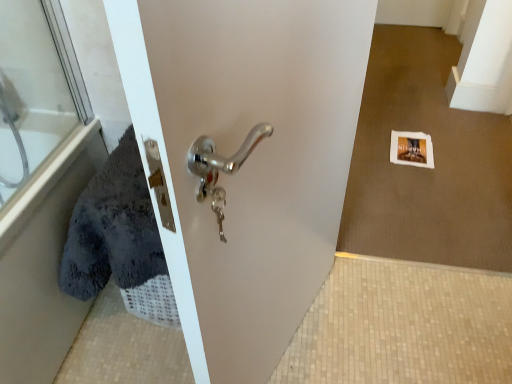
Question: From a real-world perspective, is transparent glass door at upper left on top of soft gray towel at left?

Choices:
 (A) no
 (B) yes

Answer: (B)

Question: Is soft gray towel at left at the back of transparent glass door at upper left?

Choices:
 (A) no
 (B) yes

Answer: (B)

Question: Is transparent glass door at upper left wider than soft gray towel at left?

Choices:
 (A) no
 (B) yes

Answer: (A)

Question: Is transparent glass door at upper left in contact with soft gray towel at left?

Choices:
 (A) yes
 (B) no

Answer: (B)

Question: From the image's perspective, is transparent glass door at upper left under soft gray towel at left?

Choices:
 (A) no
 (B) yes

Answer: (A)

Question: Is transparent glass door at upper left oriented towards soft gray towel at left?

Choices:
 (A) yes
 (B) no

Answer: (A)

Question: Can you confirm if soft gray towel at left is thinner than transparent glass door at upper left?

Choices:
 (A) no
 (B) yes

Answer: (A)

Question: Is soft gray towel at left positioned before transparent glass door at upper left?

Choices:
 (A) yes
 (B) no

Answer: (A)

Question: From the image's perspective, would you say soft gray towel at left is positioned over transparent glass door at upper left?

Choices:
 (A) no
 (B) yes

Answer: (A)

Question: From a real-world perspective, is soft gray towel at left located higher than transparent glass door at upper left?

Choices:
 (A) no
 (B) yes

Answer: (A)

Question: Is soft gray towel at left far from transparent glass door at upper left?

Choices:
 (A) no
 (B) yes

Answer: (A)

Question: Is soft gray towel at left bigger than transparent glass door at upper left?

Choices:
 (A) no
 (B) yes

Answer: (B)

Question: From a real-world perspective, relative to transparent glass door at upper left, is soft gray towel at left vertically above or below?

Choices:
 (A) below
 (B) above

Answer: (A)